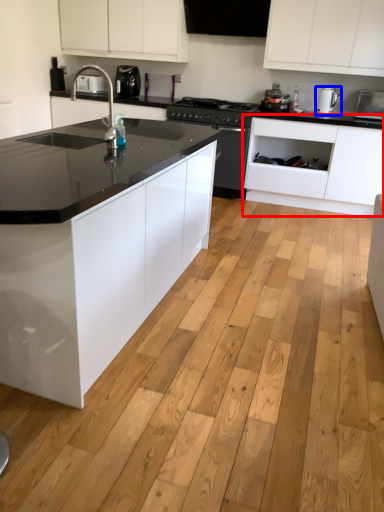
Question: Which of the following is the farthest to the observer, cabinetry (highlighted by a red box) or kitchen appliance (highlighted by a blue box)?

Choices:
 (A) cabinetry
 (B) kitchen appliance

Answer: (B)